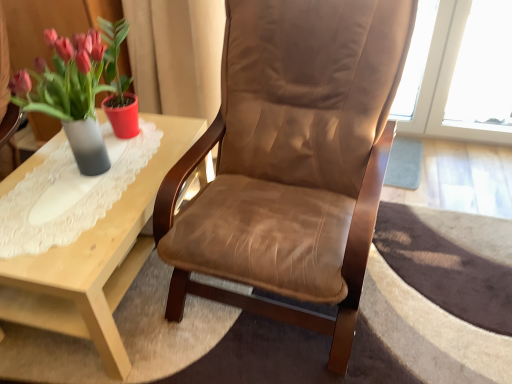
You are a GUI agent. You are given a task and a screenshot of the screen. Output one action in this format:
    pyautogui.click(x=<x>, y=<y>)
    Task: Click on the vacant space in matte gray vase at left (from a real-world perspective)
    
    Given the screenshot: What is the action you would take?
    pyautogui.click(x=82, y=173)